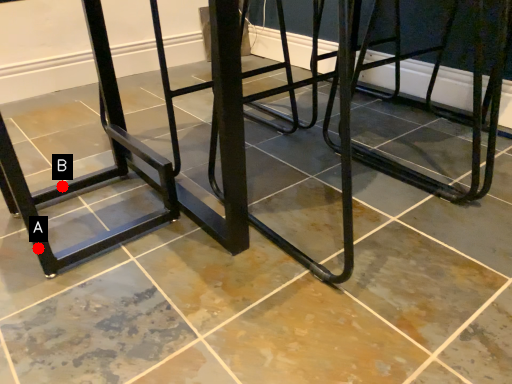
Question: Two points are circled on the image, labeled by A and B beside each circle. Which point appears closest to the camera in this image?

Choices:
 (A) A is closer
 (B) B is closer

Answer: (A)